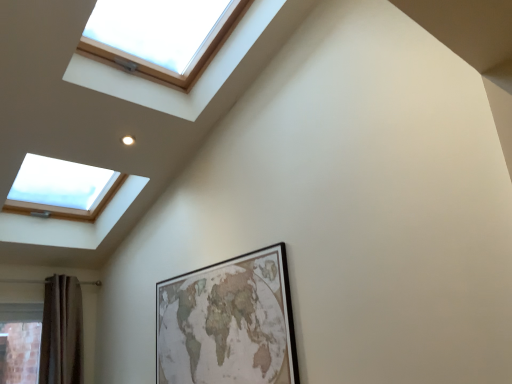
Question: Is brown textured curtain at lower left surrounding wooden frame skylight at upper left?

Choices:
 (A) no
 (B) yes

Answer: (A)

Question: Does brown textured curtain at lower left have a lesser width compared to wooden frame skylight at upper left?

Choices:
 (A) yes
 (B) no

Answer: (A)

Question: Is brown textured curtain at lower left at the left side of wooden frame skylight at upper left?

Choices:
 (A) yes
 (B) no

Answer: (A)

Question: From the image's perspective, is brown textured curtain at lower left above wooden frame skylight at upper left?

Choices:
 (A) no
 (B) yes

Answer: (A)

Question: Is brown textured curtain at lower left positioned beyond the bounds of wooden frame skylight at upper left?

Choices:
 (A) yes
 (B) no

Answer: (A)

Question: From a real-world perspective, is brown textured curtain at lower left below wooden frame skylight at upper left?

Choices:
 (A) yes
 (B) no

Answer: (A)

Question: Considering the relative sizes of wooden frame skylight at upper left and wooden framed map at center in the image provided, is wooden frame skylight at upper left smaller than wooden framed map at center?

Choices:
 (A) no
 (B) yes

Answer: (A)

Question: From a real-world perspective, is wooden frame skylight at upper left physically above wooden framed map at center?

Choices:
 (A) no
 (B) yes

Answer: (B)

Question: Is wooden frame skylight at upper left positioned with its back to wooden framed map at center?

Choices:
 (A) no
 (B) yes

Answer: (A)

Question: Can you confirm if wooden frame skylight at upper left is taller than wooden framed map at center?

Choices:
 (A) no
 (B) yes

Answer: (B)

Question: Could you tell me if wooden frame skylight at upper left is turned towards wooden framed map at center?

Choices:
 (A) no
 (B) yes

Answer: (A)

Question: Is the depth of wooden frame skylight at upper left greater than that of wooden framed map at center?

Choices:
 (A) yes
 (B) no

Answer: (B)

Question: Does wooden framed map at center have a lesser height compared to wooden frame skylight at upper left?

Choices:
 (A) yes
 (B) no

Answer: (A)